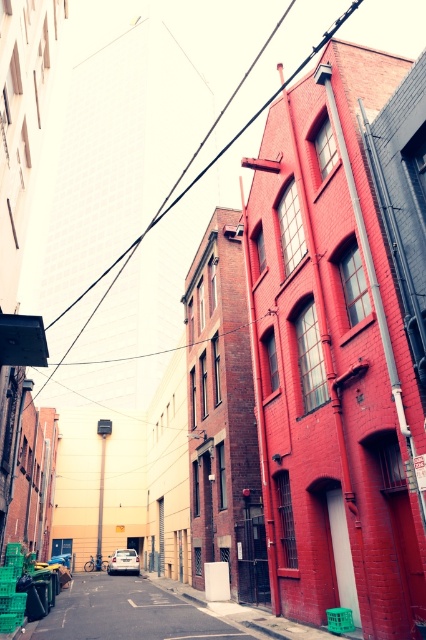
Is matte black car at center to the left of black wire at upper center from the viewer's perspective?

Indeed, matte black car at center is positioned on the left side of black wire at upper center.

Is matte black car at center smaller than black wire at upper center?

Yes, matte black car at center is smaller than black wire at upper center.

Image resolution: width=426 pixels, height=640 pixels. What do you see at coordinates (129, 612) in the screenshot? I see `matte black car at center` at bounding box center [129, 612].

This screenshot has width=426, height=640. I want to click on matte black car at center, so click(x=129, y=612).

Who is more distant from viewer, (28, 625) or (100, 536)?

The point (100, 536) is behind.

Based on the photo, is matte black car at center taller than metallic rectangular sign at center?

Correct, matte black car at center is much taller as metallic rectangular sign at center.

Measure the distance between point (51, 612) and camera.

Point (51, 612) is 13.36 meters away from camera.

Image resolution: width=426 pixels, height=640 pixels. In order to click on matte black car at center in this screenshot , I will do `click(129, 612)`.

Looking at this image, can you confirm if matte black car at center is shorter than white matte car at center?

No.

Is point (89, 602) farther from viewer compared to point (106, 566)?

No, it is not.

The width and height of the screenshot is (426, 640). I want to click on matte black car at center, so click(x=129, y=612).